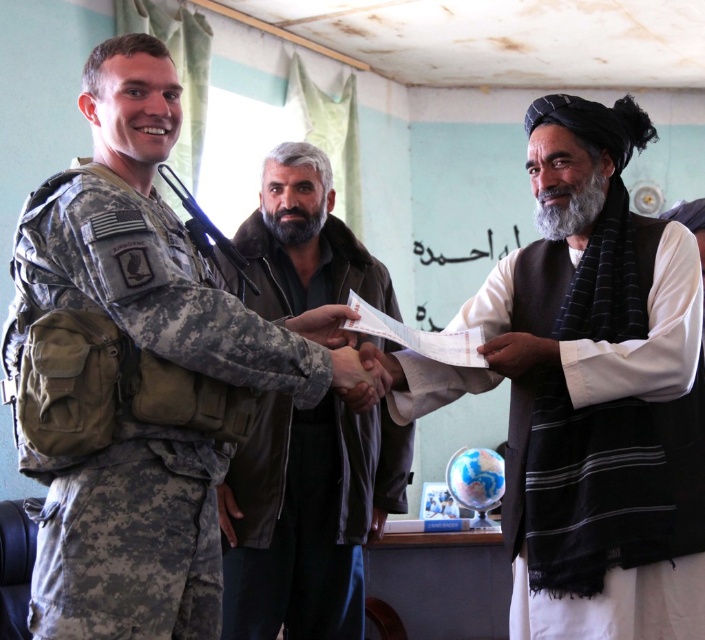
Question: Which of the following is the closest to the observer?

Choices:
 (A) (312, 218)
 (B) (599, 179)

Answer: (B)

Question: Considering the real-world distances, which object is closest to the dark brown leather jacket at center?

Choices:
 (A) camouflage uniform at left
 (B) white paper at right
 (C) white paper at center
 (D) gray/woolly beard at center

Answer: (C)

Question: Which object is farther from the camera taking this photo?

Choices:
 (A) dark brown leather jacket at center
 (B) white striped vest at center

Answer: (A)

Question: From the image, what is the correct spatial relationship of white paper at right in relation to black matte beard at center?

Choices:
 (A) above
 (B) below

Answer: (B)

Question: Does white paper at right lie behind black matte beard at center?

Choices:
 (A) yes
 (B) no

Answer: (B)

Question: Can you confirm if white paper at right is thinner than black matte beard at center?

Choices:
 (A) no
 (B) yes

Answer: (B)